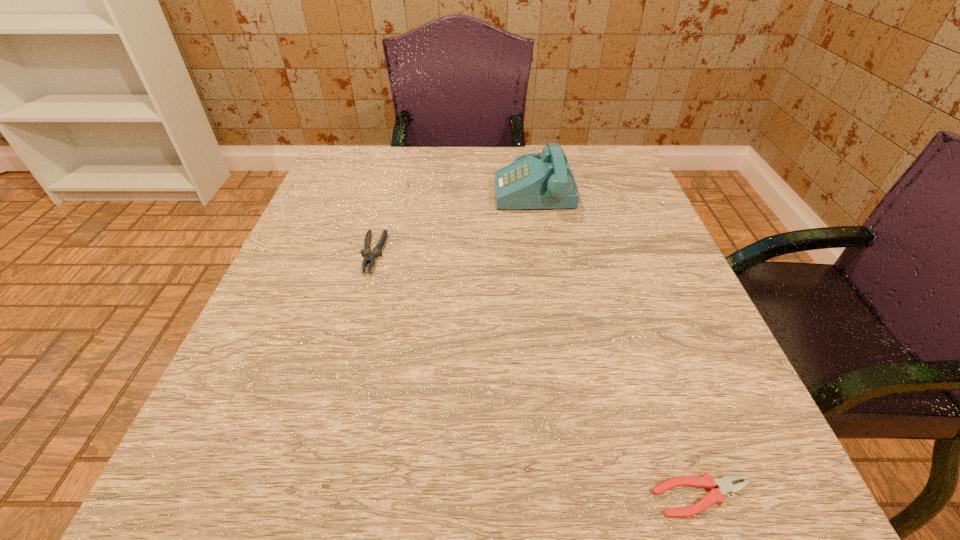
Locate an element on the screen. Image resolution: width=960 pixels, height=540 pixels. vacant area situated 0.100m on the left of the right pliers is located at coordinates (567, 497).

Where is `object located in the far edge section of the desktop`? The image size is (960, 540). object located in the far edge section of the desktop is located at coordinates (528, 183).

Where is `object that is at the near edge`? The image size is (960, 540). object that is at the near edge is located at coordinates (724, 485).

Where is `object at the left edge`? object at the left edge is located at coordinates (x=370, y=257).

I want to click on telephone that is at the right edge, so click(x=528, y=183).

The height and width of the screenshot is (540, 960). What are the coordinates of `pliers that is at the right edge` in the screenshot? It's located at pyautogui.click(x=724, y=485).

I want to click on object present at the far right corner, so click(528, 183).

Locate an element on the screen. object at the near right corner is located at coordinates (724, 485).

Identify the location of free region at the far edge of the desktop. The height and width of the screenshot is (540, 960). (427, 185).

The height and width of the screenshot is (540, 960). In the image, there is a desktop. In order to click on vacant space at the near edge in this screenshot , I will do `click(648, 481)`.